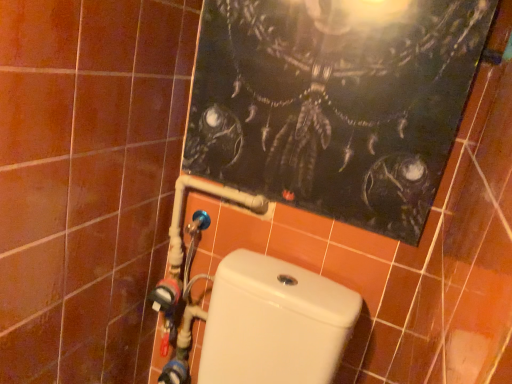
Question: From the image's perspective, is blue plastic water pipe at lower left above or below white glossy toilet at lower center?

Choices:
 (A) above
 (B) below

Answer: (A)

Question: Considering the positions of blue plastic water pipe at lower left and white glossy toilet at lower center in the image, is blue plastic water pipe at lower left taller or shorter than white glossy toilet at lower center?

Choices:
 (A) tall
 (B) short

Answer: (A)

Question: Which object is the farthest from the brown matte tile at left?

Choices:
 (A) white glossy toilet at lower center
 (B) blue plastic water pipe at lower left
 (C) dark matte poster at upper center

Answer: (A)

Question: Based on their relative distances, which object is farther from the white glossy toilet at lower center?

Choices:
 (A) blue plastic water pipe at lower left
 (B) dark matte poster at upper center
 (C) brown matte tile at left

Answer: (C)